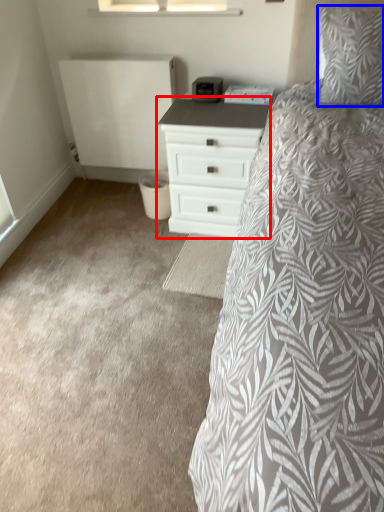
Question: Which object is closer to the camera taking this photo, chest of drawers (highlighted by a red box) or pillow (highlighted by a blue box)?

Choices:
 (A) chest of drawers
 (B) pillow

Answer: (B)